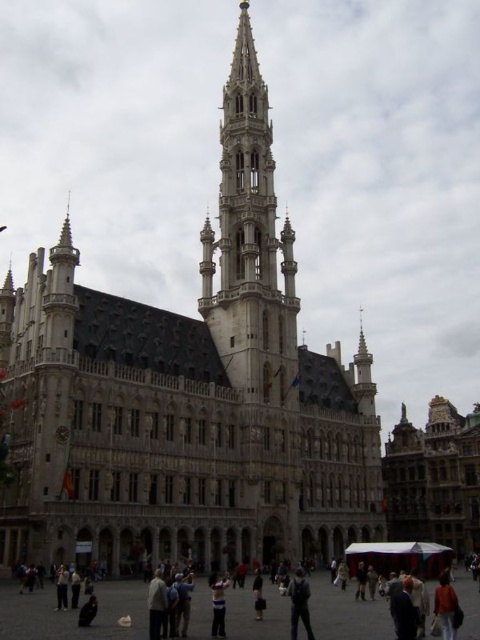
You are standing in front of the grand historical building and notice two items in the scene. One is the brick paved square at center and the other is the orange fabric jacket at lower right. From your perspective, which of these two items is positioned to the left?

The brick paved square at center is positioned to the left of the orange fabric jacket at lower right.

You are a photographer standing 5 meters away from the dark blue suit at center and dark gray pants at center. You want to take a photo of both objects in the same frame. Can you do this without moving your position?

The dark blue suit at center and dark gray pants at center are 6.06 meters apart. Since you are standing 5 meters away from them, the distance between the two objects is greater than your distance from them, making it difficult to capture both in the same frame without moving. Therefore, you cannot take a photo of both objects in the same frame without moving your position.